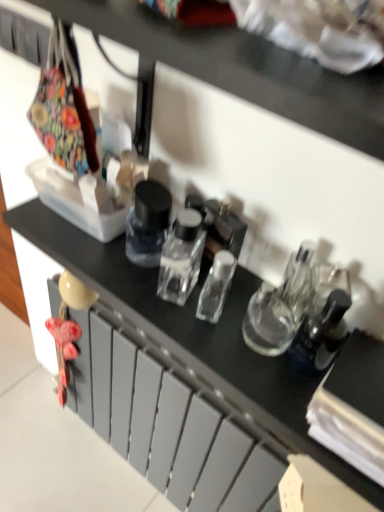
This screenshot has height=512, width=384. Identify the location of vacant area on top of matte gray drawer at center (from a real-world perspective). (178, 368).